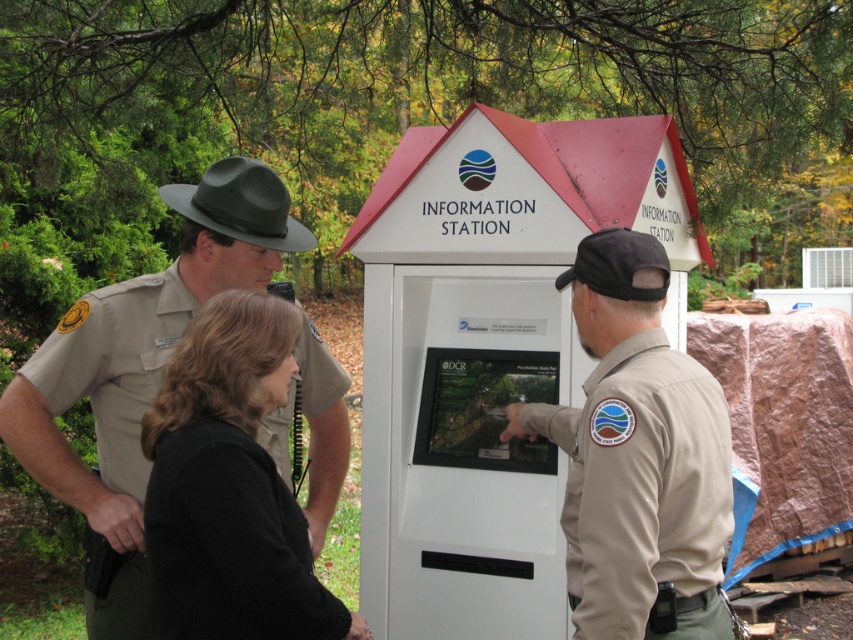
You are a visitor at the information kiosk and see the tan uniform at left and the black fabric jacket at center. Which person is closer to the kiosk?

The tan uniform at left is closer to the kiosk because it is positioned to the left of the black fabric jacket at center, which is further away.

You are standing at the point labeled as point [637,458] in the image. What is the color of the uniform of the person you are directly facing?

The tan uniform at center is located at point [637,458], so the color of the uniform of the person you are directly facing is tan.